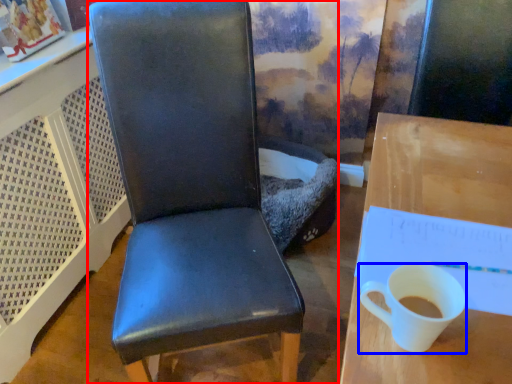
Question: Which of the following is the closest to the observer, chair (highlighted by a red box) or coffee cup (highlighted by a blue box)?

Choices:
 (A) chair
 (B) coffee cup

Answer: (B)